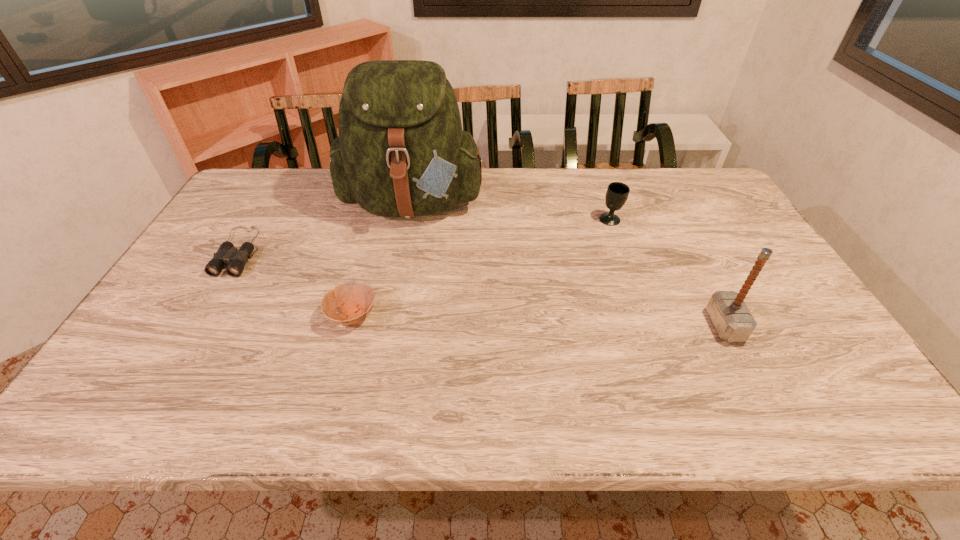
Where is `free space between the second object from right to left and the leftmost object`? free space between the second object from right to left and the leftmost object is located at coordinates (424, 235).

Where is `free spot between the tallest object and the fourth object from left to right`? The height and width of the screenshot is (540, 960). free spot between the tallest object and the fourth object from left to right is located at coordinates (513, 211).

What are the coordinates of `object that stands as the third closest to the fourth tallest object` in the screenshot? It's located at (617, 193).

Locate which object ranks in proximity to the bowl. Please provide its 2D coordinates. Your answer should be formatted as a tuple, i.e. [(x, y)], where the tuple contains the x and y coordinates of a point satisfying the conditions above.

[(401, 152)]

You are a GUI agent. You are given a task and a screenshot of the screen. Output one action in this format:
    pyautogui.click(x=<x>, y=<y>)
    Task: Click on the vacant region that satisfies the following two spatial constraints: 1. at the eyepiece of the bowl; 2. on the left side of the binoculars
    
    Given the screenshot: What is the action you would take?
    pyautogui.click(x=201, y=315)

You are a GUI agent. You are given a task and a screenshot of the screen. Output one action in this format:
    pyautogui.click(x=<x>, y=<y>)
    Task: Click on the free spot that satisfies the following two spatial constraints: 1. at the eyepiece of the bowl; 2. on the left side of the leftmost object
    
    Given the screenshot: What is the action you would take?
    pyautogui.click(x=201, y=315)

Locate an element on the screen. This screenshot has height=540, width=960. vacant area that satisfies the following two spatial constraints: 1. at the eyepiece of the second shortest object; 2. on the right side of the leftmost object is located at coordinates (201, 315).

Locate an element on the screen. free region that satisfies the following two spatial constraints: 1. at the eyepiece of the fourth tallest object; 2. on the right side of the binoculars is located at coordinates (201, 315).

Locate an element on the screen. Image resolution: width=960 pixels, height=540 pixels. free spot that satisfies the following two spatial constraints: 1. at the eyepiece of the shortest object; 2. on the left side of the second shortest object is located at coordinates (201, 315).